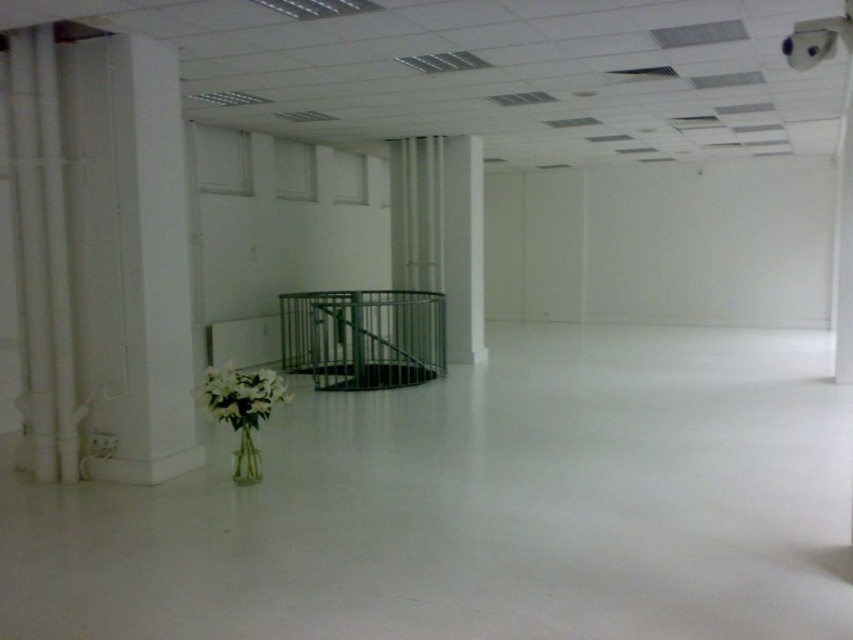
You are standing in the middle of the room and want to move towards both points. Which point would you reach first, point (178, 209) or point (207, 374)?

Point (178, 209) is closer to you, so you would reach it first.

You are standing in the large room and want to walk towards the two points marked in the image. Which point, point (142, 436) or point (236, 460), will you reach first?

You will reach point (142, 436) first because it is closer to you than point (236, 460), which is further away.

Consider the image. You are standing in the center of the room and want to place a new decorative item exactly halfway between the white smooth pillar at left and the transparent vase with white flowers. Where should you place it?

The white smooth pillar at left is located at point (129, 253). To find the halfway point between the pillar and the vase, you would need to know the coordinates of the vase. Since the vase is in the foreground and the pillar is at the left, the exact halfway point can be calculated once the vase coordinates are known.